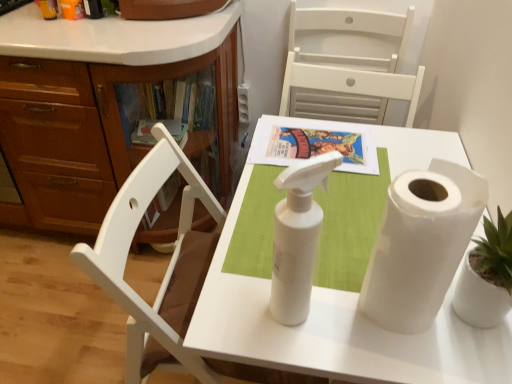
Where is `vacant space in front of white paper at right`? This screenshot has width=512, height=384. vacant space in front of white paper at right is located at coordinates (418, 359).